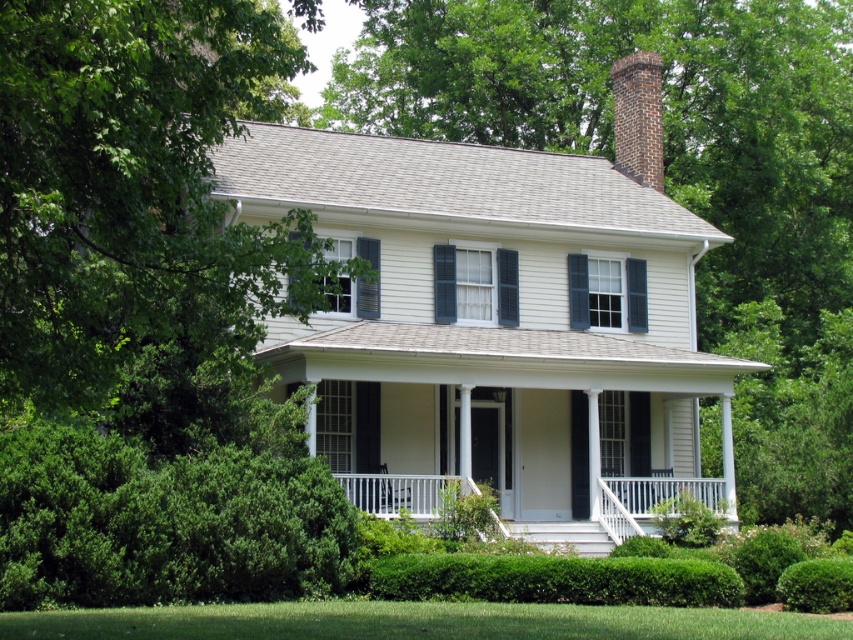
Question: Can you confirm if green leafy tree at center is wider than white painted wood porch at center?

Choices:
 (A) no
 (B) yes

Answer: (B)

Question: Based on their relative distances, which object is nearer to the green matte shutter at center?

Choices:
 (A) green leafy tree at upper left
 (B) brick chimney at upper right
 (C) blue painted wood shutter at center
 (D) white painted wood porch at center

Answer: (C)

Question: Is white painted wood porch at center bigger than blue painted wood shutter at center?

Choices:
 (A) yes
 (B) no

Answer: (A)

Question: Can you confirm if green leafy tree at center is smaller than white painted wood porch at center?

Choices:
 (A) yes
 (B) no

Answer: (B)

Question: Which object is closer to the camera taking this photo?

Choices:
 (A) brick chimney at upper right
 (B) green leafy hedge at lower center
 (C) blue painted wood shutter at center
 (D) green matte shutter at lower left

Answer: (B)

Question: Which object is farther from the camera taking this photo?

Choices:
 (A) green leafy hedge at lower center
 (B) blue painted wood shutter at center

Answer: (B)